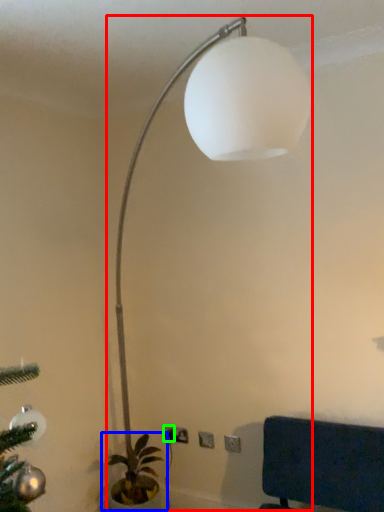
Question: Estimate the real-world distances between objects in this image. Which object is closer to lamp (highlighted by a red box), houseplant (highlighted by a blue box) or electric outlet (highlighted by a green box)?

Choices:
 (A) houseplant
 (B) electric outlet

Answer: (A)